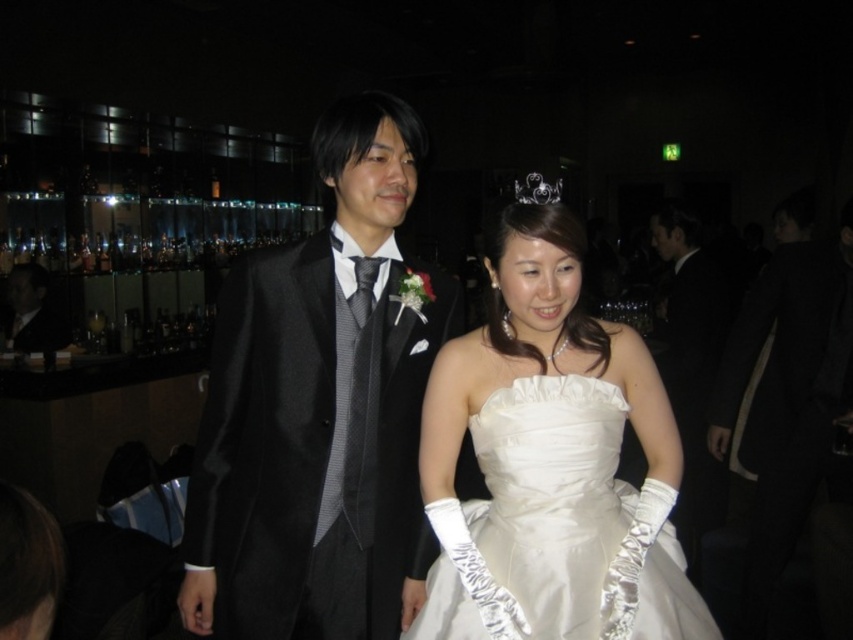
Where is `black satin suit at left`? The width and height of the screenshot is (853, 640). black satin suit at left is located at coordinates (32, 312).

Is point (13, 346) farther from camera compared to point (515, 186)?

No, (13, 346) is in front of (515, 186).

The height and width of the screenshot is (640, 853). I want to click on black satin suit at left, so click(32, 312).

Is white satin dress at center to the right of silver metallic tiara at upper center from the viewer's perspective?

In fact, white satin dress at center is to the left of silver metallic tiara at upper center.

Does white satin dress at center have a lesser height compared to silver metallic tiara at upper center?

No.

This screenshot has height=640, width=853. I want to click on white satin dress at center, so click(550, 464).

Does point (318, 132) come in front of point (68, 339)?

Yes, it is in front of point (68, 339).

Who is shorter, matte black suit at center or black satin suit at left?

Standing shorter between the two is black satin suit at left.

Is point (393, 600) positioned after point (56, 348)?

No, (393, 600) is closer to viewer.

Find the location of a particular element. The height and width of the screenshot is (640, 853). matte black suit at center is located at coordinates (320, 412).